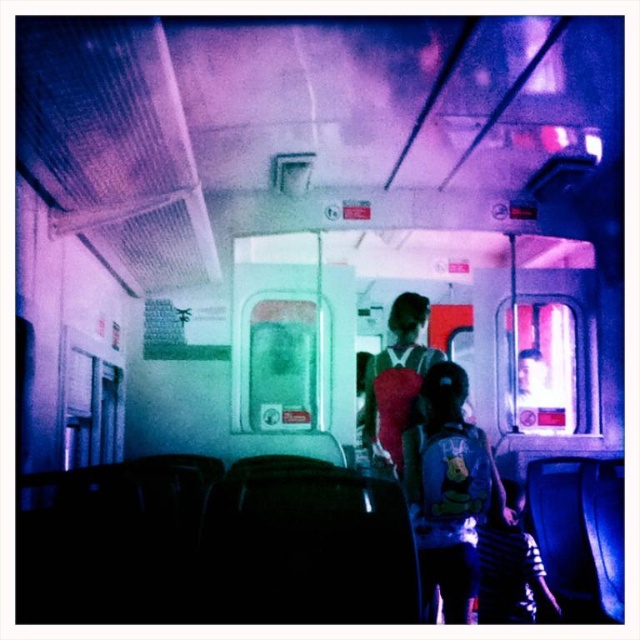
You are a passenger on the train and want to retrieve your matte blue backpack at center. However, there is a matte pink backpack at center in the way. Based on the scene description, can you reach your backpack without moving the pink one?

The matte blue backpack at center is located below the matte pink backpack at center, so you can reach it without moving the pink one as it is positioned underneath.

You are a passenger sitting in the train car and you have two backpacks in front of you, the matte blue backpack at center and the matte pink backpack at center. Which backpack is blocking your view of the other?

The matte blue backpack at center is blocking your view of the matte pink backpack at center because it is positioned in front of it.

You are a passenger in the train car and need to store your backpack. You see the matte blue backpack at center and the matte pink backpack at center. Which backpack takes up more vertical space?

The matte blue backpack at center is taller than the matte pink backpack at center, so it takes up more vertical space.